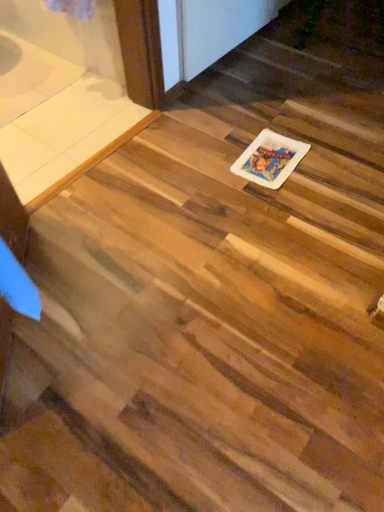
At what (x,y) coordinates should I click in order to perform the action: click on free space above white glossy book at center (from a real-world perspective). Please return your answer as a coordinate pair (x, y). The image size is (384, 512). Looking at the image, I should click on (268, 154).